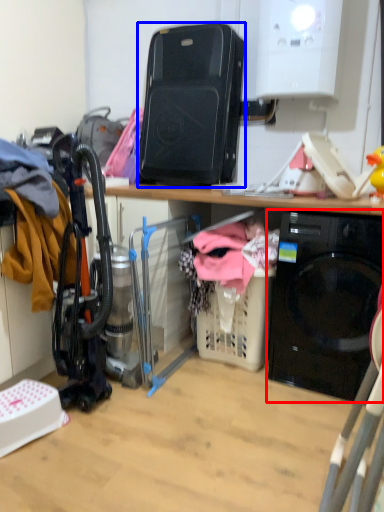
Question: Which of the following is the farthest to the observer, home appliance (highlighted by a red box) or appliance (highlighted by a blue box)?

Choices:
 (A) home appliance
 (B) appliance

Answer: (B)